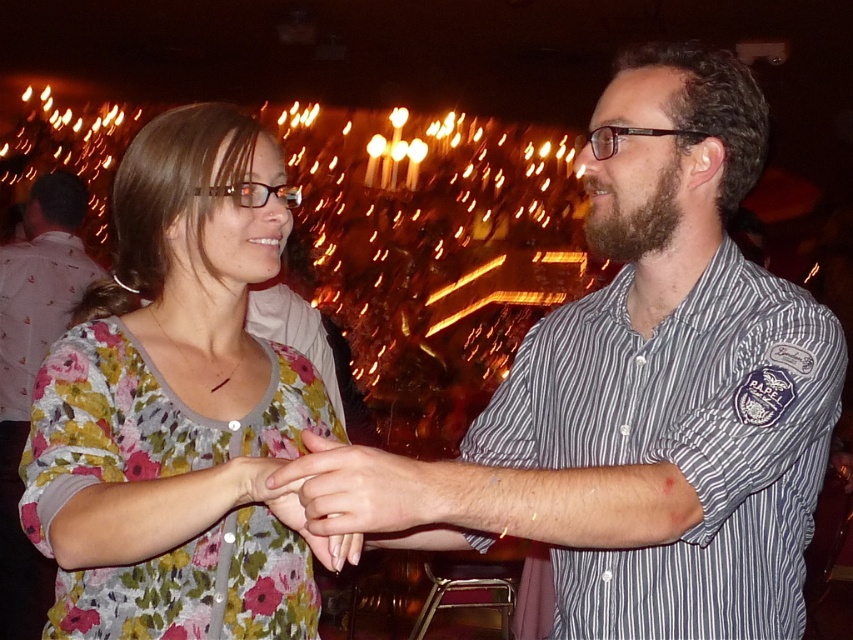
Who is higher up, floral print blouse at left or striped cotton shirt at right?

floral print blouse at left is higher up.

Can you confirm if floral print blouse at left is positioned below striped cotton shirt at right?

Actually, floral print blouse at left is above striped cotton shirt at right.

Is point (44, 477) farther from camera compared to point (712, 579)?

Yes, point (44, 477) is behind point (712, 579).

The width and height of the screenshot is (853, 640). What are the coordinates of `floral print blouse at left` in the screenshot? It's located at (178, 408).

Is the position of floral print blouse at left less distant than that of smooth skin hands at center?

No, floral print blouse at left is further to the viewer.

Does floral print blouse at left appear on the left side of smooth skin hands at center?

Correct, you'll find floral print blouse at left to the left of smooth skin hands at center.

Identify the location of floral print blouse at left. (178, 408).

Does striped cotton shirt at center have a lesser width compared to striped cotton shirt at right?

In fact, striped cotton shirt at center might be wider than striped cotton shirt at right.

Measure the distance between striped cotton shirt at center and camera.

A distance of 1.04 meters exists between striped cotton shirt at center and camera.

Locate an element on the screen. This screenshot has height=640, width=853. striped cotton shirt at center is located at coordinates (639, 394).